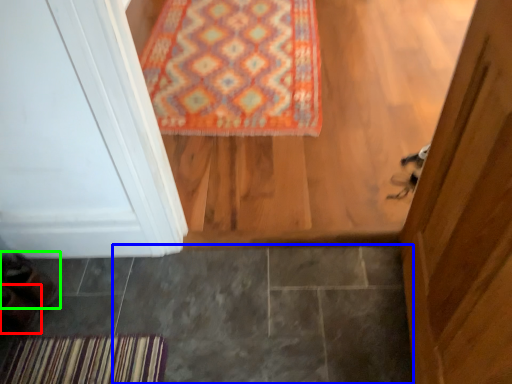
Question: Considering the real-world distances, which object is farthest from shoe (highlighted by a red box)? tile (highlighted by a blue box) or shoe (highlighted by a green box)?

Choices:
 (A) tile
 (B) shoe

Answer: (A)